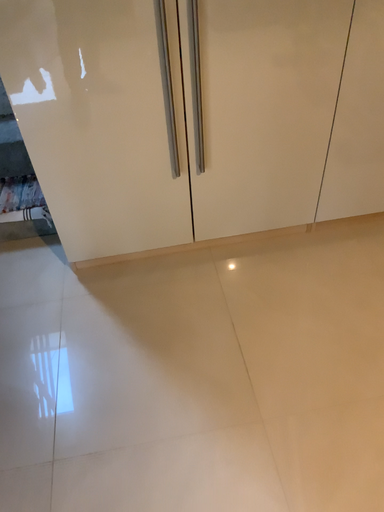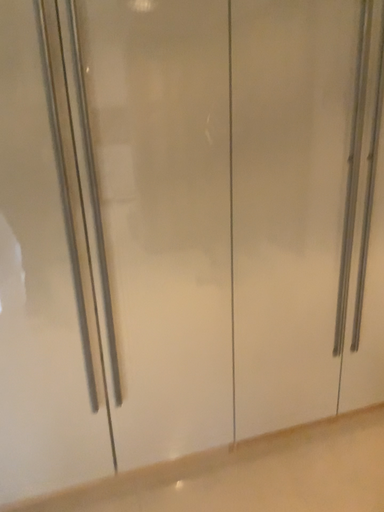
Question: How did the camera likely rotate when shooting the video?

Choices:
 (A) rotated upward
 (B) rotated downward

Answer: (A)